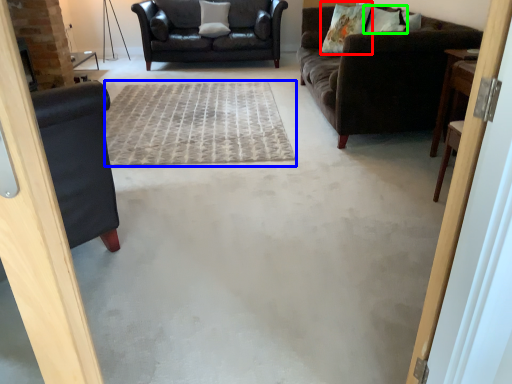
Question: Which object is the farthest from pillow (highlighted by a red box)? Choose among these: plain (highlighted by a blue box) or pillow (highlighted by a green box).

Choices:
 (A) plain
 (B) pillow

Answer: (A)